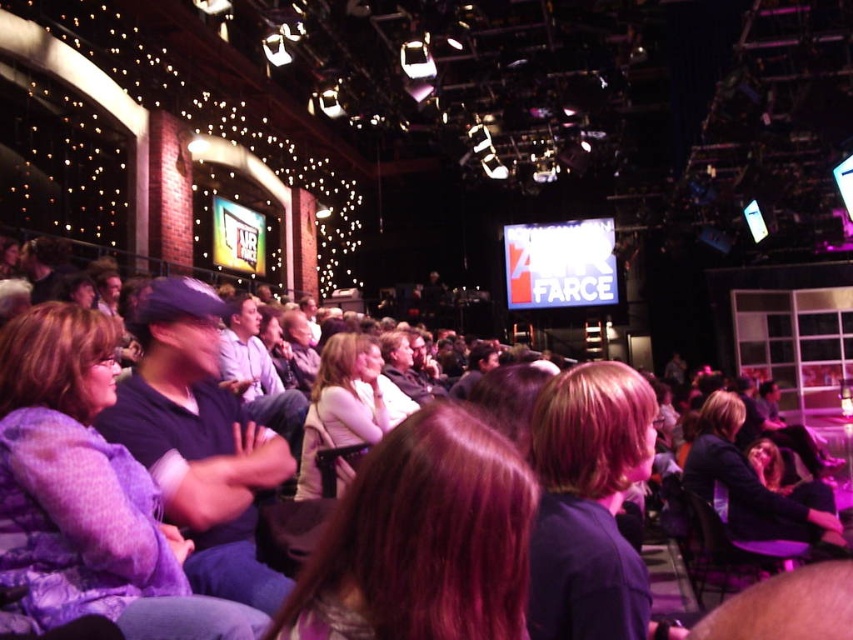
You are an usher in the theater. You need to guide a guest to the seat directly behind the dark purple shirt at center and the dark blue sweater at center. Since both are seated in the same row, which direction should the guest walk along the row to reach the correct seat?

The guest should walk to the right along the row to reach the seat behind the dark purple shirt at center, since it is to the left of the dark blue sweater at center.

You are an audience member sitting in the front row of the studio. You notice two points marked on the stage floor. The first point is labeled as point (630,424) and the second is point (737,522). From your seat, which point is closer to you?

Point (630,424) is in front of point (737,522), so it is closer to you.